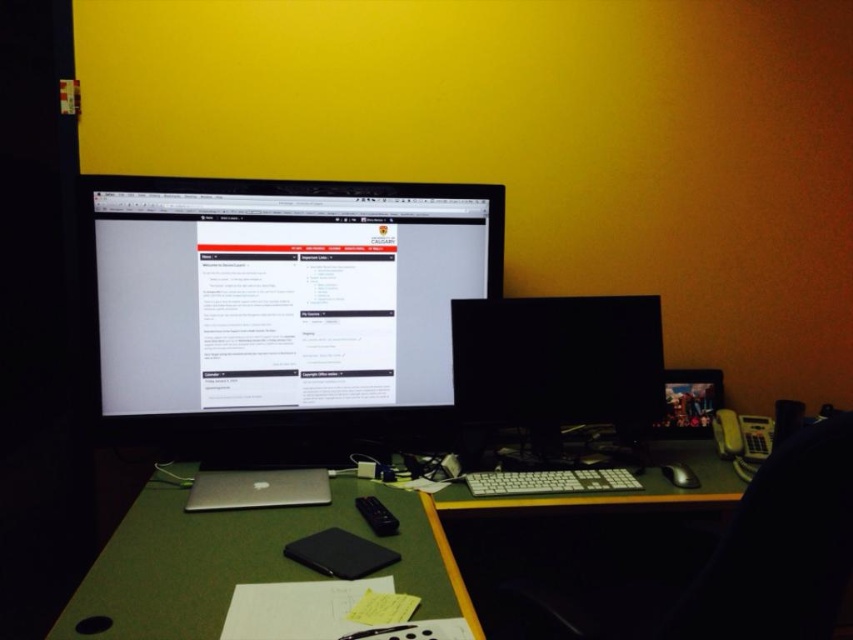
Question: Does silver metallic laptop at center appear over black plastic mouse at lower right?

Choices:
 (A) no
 (B) yes

Answer: (A)

Question: Is black glossy monitor at center smaller than black plastic mouse at lower right?

Choices:
 (A) no
 (B) yes

Answer: (A)

Question: Which point is farther to the camera?

Choices:
 (A) matte black monitor at center
 (B) black glossy monitor at center
 (C) green felt table at lower center

Answer: (B)

Question: Which object is positioned closest to the black plastic mouse at lower right?

Choices:
 (A) black plastic chair at right
 (B) silver metallic laptop at center

Answer: (A)

Question: Is matte black monitor at center above black plastic chair at right?

Choices:
 (A) yes
 (B) no

Answer: (A)

Question: Which point is farther to the camera?

Choices:
 (A) (450, 307)
 (B) (108, 401)
 (C) (578, 496)

Answer: (A)